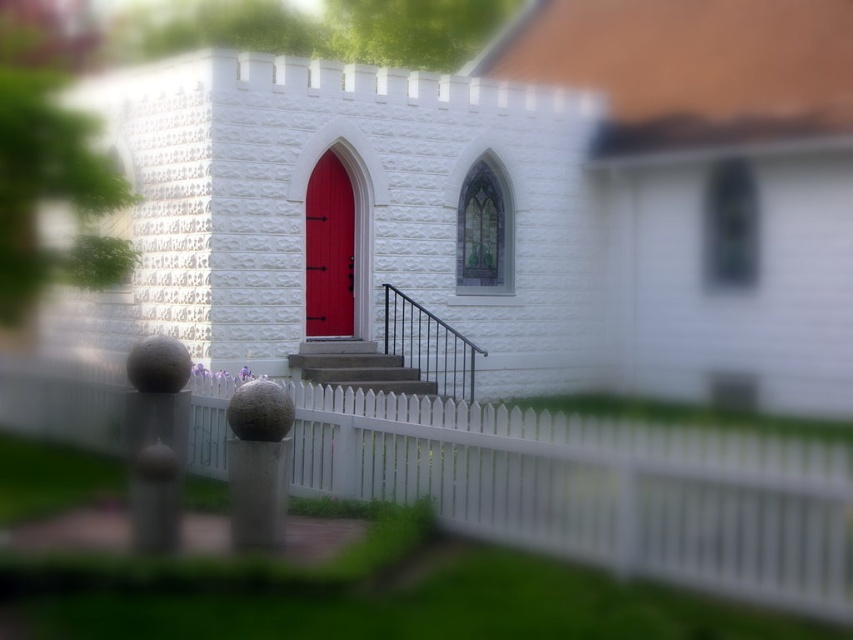
Question: Does white picket fence at center have a smaller size compared to matte wood door at center?

Choices:
 (A) yes
 (B) no

Answer: (B)

Question: Which of the following is the farthest from the observer?

Choices:
 (A) matte wood door at center
 (B) smooth concrete stairs at center

Answer: (A)

Question: Can you confirm if white stone church at center is positioned to the right of matte wood door at center?

Choices:
 (A) yes
 (B) no

Answer: (A)

Question: Which point is farther from the camera taking this photo?

Choices:
 (A) (753, 243)
 (B) (340, 349)
 (C) (12, 428)

Answer: (A)

Question: Which point is farther from the camera taking this photo?

Choices:
 (A) (x=335, y=435)
 (B) (x=622, y=291)

Answer: (B)

Question: Is white stone church at center positioned behind white picket fence at center?

Choices:
 (A) yes
 (B) no

Answer: (A)